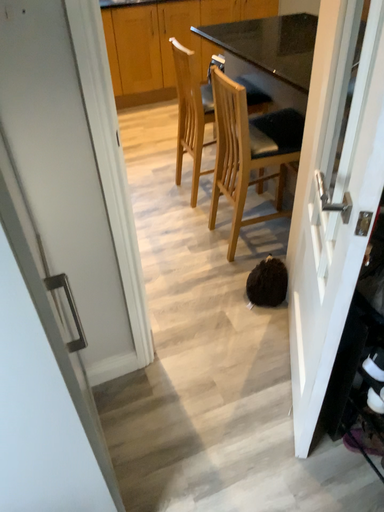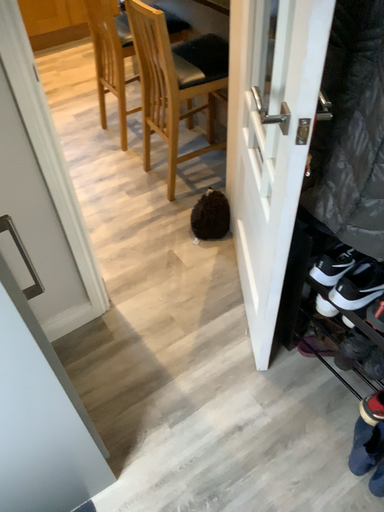
Question: How did the camera likely rotate when shooting the video?

Choices:
 (A) rotated upward
 (B) rotated downward

Answer: (B)